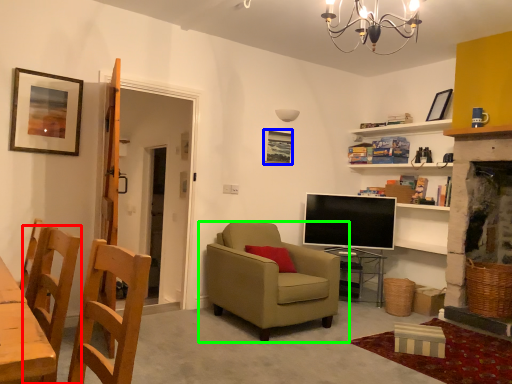
Question: Which is nearer to the chair (highlighted by a red box)? picture frame (highlighted by a blue box) or chair (highlighted by a green box).

Choices:
 (A) picture frame
 (B) chair

Answer: (B)